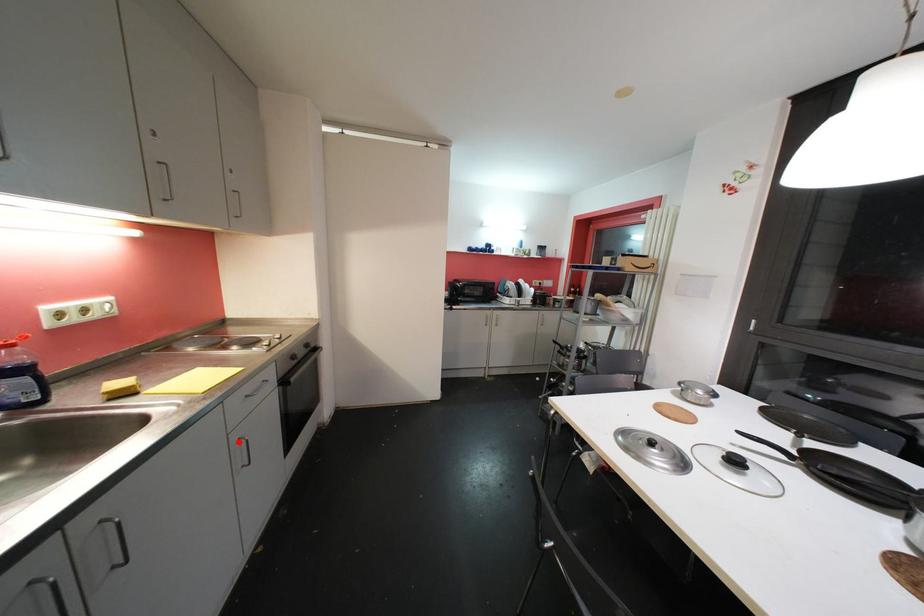
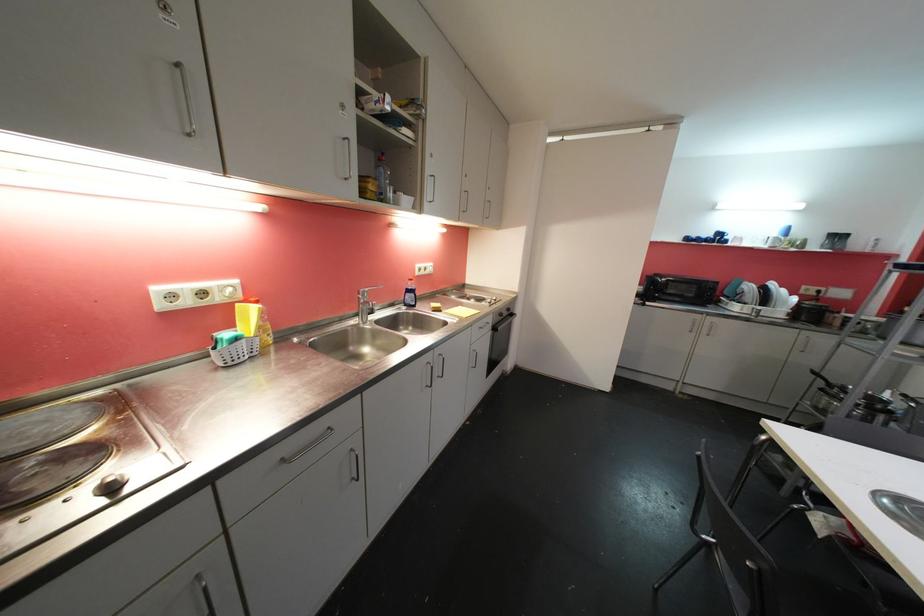
Locate, in the second image, the point that corresponds to the highlighted location in the first image.

(477, 352)